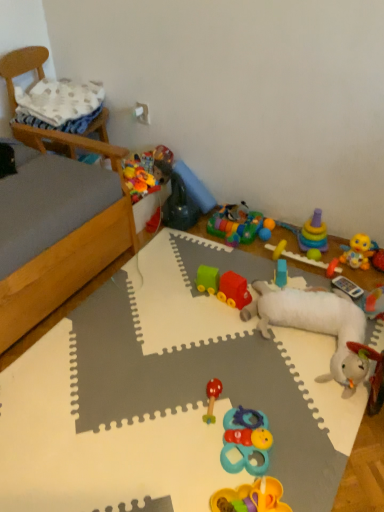
Question: Which direction should I rotate to look at multicolored plastic blocks at center, the second toy from the top?

Choices:
 (A) right
 (B) left

Answer: (A)

Question: Does wooden chair at upper left come behind wooden bed frame at left?

Choices:
 (A) yes
 (B) no

Answer: (A)

Question: Is wooden chair at upper left to the right of wooden bed frame at left from the viewer's perspective?

Choices:
 (A) no
 (B) yes

Answer: (B)

Question: Is wooden chair at upper left next to wooden bed frame at left?

Choices:
 (A) no
 (B) yes

Answer: (A)

Question: Does wooden chair at upper left have a smaller size compared to wooden bed frame at left?

Choices:
 (A) yes
 (B) no

Answer: (A)

Question: From a real-world perspective, is wooden chair at upper left physically below wooden bed frame at left?

Choices:
 (A) no
 (B) yes

Answer: (A)

Question: Is wooden bed frame at left a part of wooden chair at upper left?

Choices:
 (A) yes
 (B) no

Answer: (B)

Question: Is white plush sheep at center, the third toy ordered from the bottom, to the right of rubberized green toy at center, the tenth toy when ordered from bottom to top, from the viewer's perspective?

Choices:
 (A) no
 (B) yes

Answer: (B)

Question: Is white plush sheep at center, the third toy ordered from the bottom, closer to the viewer compared to rubberized green toy at center, positioned as the 1th toy in top-to-bottom order?

Choices:
 (A) no
 (B) yes

Answer: (B)

Question: Is white plush sheep at center, the 8th toy viewed from the top, thinner than rubberized green toy at center, the tenth toy when ordered from bottom to top?

Choices:
 (A) yes
 (B) no

Answer: (B)

Question: Considering the relative sizes of white plush sheep at center, the 8th toy viewed from the top, and rubberized green toy at center, positioned as the 1th toy in top-to-bottom order, in the image provided, is white plush sheep at center, the 8th toy viewed from the top, wider than rubberized green toy at center, positioned as the 1th toy in top-to-bottom order,?

Choices:
 (A) no
 (B) yes

Answer: (B)

Question: Is white plush sheep at center, the 8th toy viewed from the top, completely or partially outside of rubberized green toy at center, positioned as the 1th toy in top-to-bottom order?

Choices:
 (A) yes
 (B) no

Answer: (A)

Question: Would you say rubberized green toy at center, positioned as the 1th toy in top-to-bottom order, is part of white plush sheep at center, the 8th toy viewed from the top,'s contents?

Choices:
 (A) yes
 (B) no

Answer: (B)

Question: Is rubberized plastic train at center, which is counted as the 4th toy, starting from the bottom, bigger than white plush sheep at center, the third toy ordered from the bottom?

Choices:
 (A) no
 (B) yes

Answer: (A)